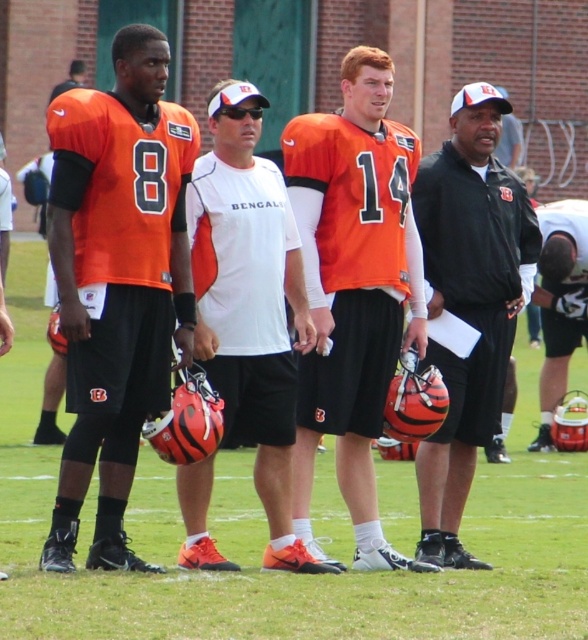
You are a photographer setting up for a team photo. You need to ensure that the matte orange jersey at left and the white matte helmet at center are both visible in the frame. Given their sizes, which object should you focus on to ensure both are in focus?

The matte orange jersey at left is bigger than the white matte helmet at center, so focusing on the matte orange jersey at left will ensure both are in focus as it requires a wider depth of field.

You are a photographer positioned at the back of the field. You want to take a photo of both the matte orange jersey at left and the orange matte jersey at center. Which jersey should you adjust your camera angle to focus on first to ensure both are in frame?

The matte orange jersey at left is located below the orange matte jersey at center. To ensure both are in frame, focus on the orange matte jersey at center first, then adjust the angle to include the lower positioned matte orange jersey at left.

You are a photographer standing at the edge of the football field. You want to take a photo of the white matte shirt at center. Where should you position yourself to capture it in the frame?

The white matte shirt at center is located at point (250, 304), so you should position yourself at a central angle facing that coordinate to ensure it is centered in your frame.